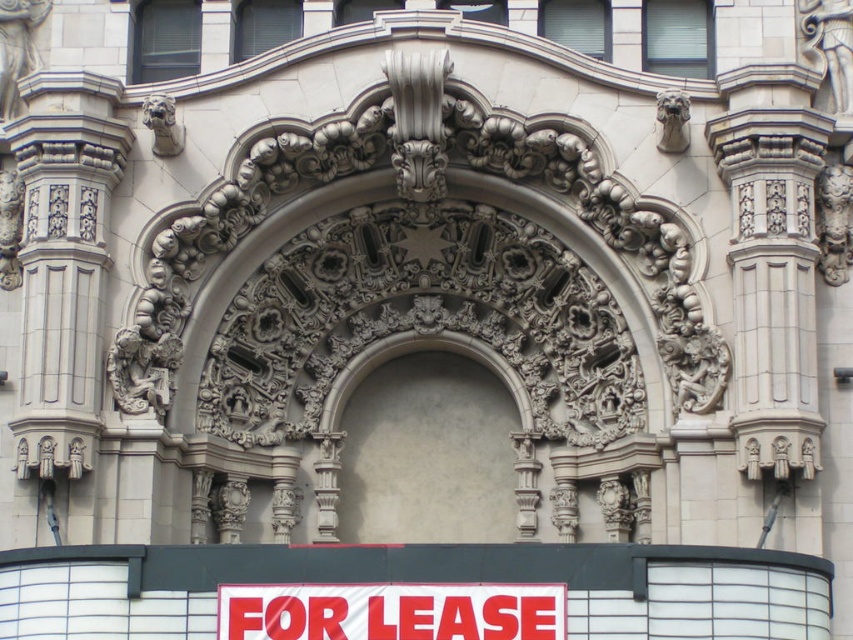
You are an architect examining the facade and need to install a new light fixture. The light fixture must be placed above the white plastic sign at center. Is the smooth beige arch at center an appropriate location for this installation?

The smooth beige arch at center is positioned over the white plastic sign at center, so it is an appropriate location to install the light fixture above the sign.